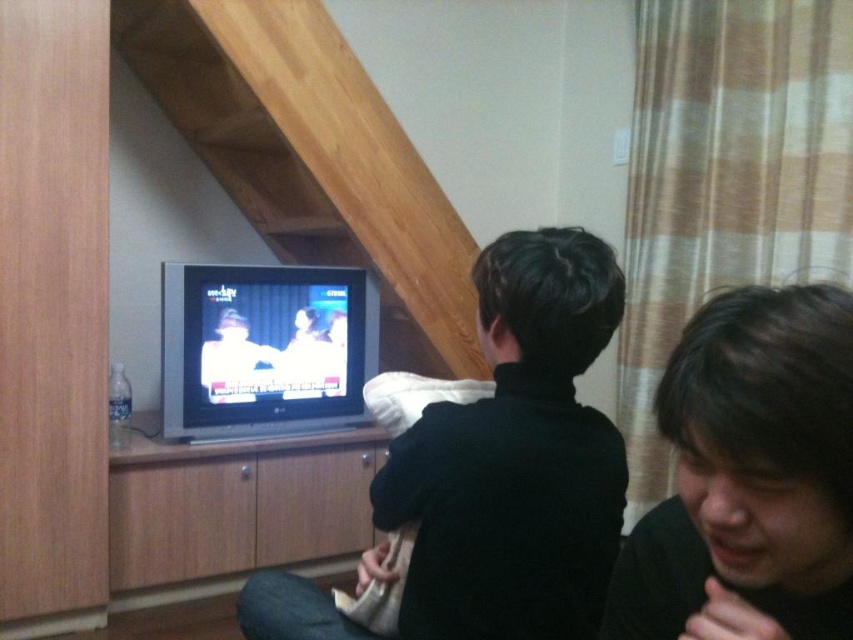
Please describe the location of the point marked at coordinates (515, 458) in the scene.

The point at coordinates (515, 458) is located on the black matte shirt at center.

You are a photographer trying to capture a candid shot of both the black matte shirt at center and the dark brown hair at lower right. Since you want to ensure both subjects are in focus, you need to know which one is closer to the camera. Can you determine which one is nearer?

The black matte shirt at center is taller than dark brown hair at lower right, so the dark brown hair at lower right is closer to the camera.

You are a photographer standing in the room. You want to take a photo of the black matte shirt at center and dark brown hair at lower right so that both are in focus. The camera you are using has a depth of field that can cover 16 inches. Will both subjects be in focus?

The black matte shirt at center and dark brown hair at lower right are 16.74 inches apart from each other. Since the depth of field can only cover 16 inches, the distance between them exceeds the camera s capability, so both subjects may not be in focus simultaneously.